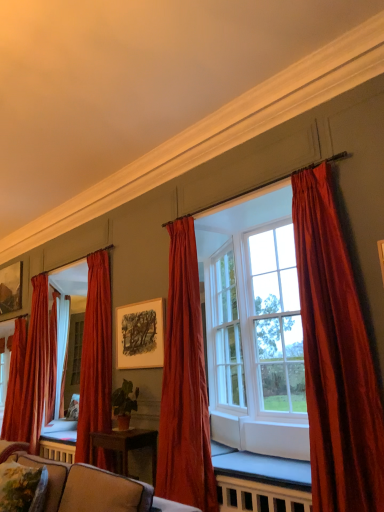
Question: Could you tell me if velvet red curtain at left, which appears as the 5th curtain when viewed from the right, is turned towards velvet curtains at center?

Choices:
 (A) no
 (B) yes

Answer: (A)

Question: Considering the relative sizes of velvet red curtain at left, positioned as the fifth curtain in front-to-back order, and velvet curtains at center in the image provided, is velvet red curtain at left, positioned as the fifth curtain in front-to-back order, wider than velvet curtains at center?

Choices:
 (A) yes
 (B) no

Answer: (B)

Question: Does velvet red curtain at left, positioned as the fifth curtain in front-to-back order, have a larger size compared to velvet curtains at center?

Choices:
 (A) no
 (B) yes

Answer: (A)

Question: Considering the relative sizes of velvet red curtain at left, positioned as the 1th curtain in back-to-front order, and velvet curtains at center in the image provided, is velvet red curtain at left, positioned as the 1th curtain in back-to-front order, smaller than velvet curtains at center?

Choices:
 (A) yes
 (B) no

Answer: (A)

Question: From a real-world perspective, is velvet red curtain at left, positioned as the fifth curtain in front-to-back order, physically below velvet curtains at center?

Choices:
 (A) no
 (B) yes

Answer: (B)

Question: Is velvet curtains at center located within velvet red curtain at left, which appears as the 1th curtain when viewed from the left?

Choices:
 (A) yes
 (B) no

Answer: (B)

Question: From a real-world perspective, is velvet floral pillow at lower left physically above matte white picture frame at center, which is the first picture frame in front-to-back order?

Choices:
 (A) no
 (B) yes

Answer: (A)

Question: Considering the relative sizes of velvet floral pillow at lower left and matte white picture frame at center, placed as the first picture frame when sorted from right to left, in the image provided, is velvet floral pillow at lower left taller than matte white picture frame at center, placed as the first picture frame when sorted from right to left,?

Choices:
 (A) yes
 (B) no

Answer: (B)

Question: Is velvet floral pillow at lower left at the right side of matte white picture frame at center, marked as the second picture frame in a back-to-front arrangement?

Choices:
 (A) no
 (B) yes

Answer: (A)

Question: Is velvet floral pillow at lower left wider than matte white picture frame at center, which is the first picture frame in front-to-back order?

Choices:
 (A) yes
 (B) no

Answer: (A)

Question: Could you tell me if velvet floral pillow at lower left is facing matte white picture frame at center, which is the first picture frame in front-to-back order?

Choices:
 (A) yes
 (B) no

Answer: (B)

Question: From the image's perspective, does velvet floral pillow at lower left appear lower than matte white picture frame at center, placed as the first picture frame when sorted from right to left?

Choices:
 (A) no
 (B) yes

Answer: (B)

Question: Can you confirm if velvet red curtain at left, which appears as the 5th curtain when viewed from the right, is smaller than velvet red curtain at right, which is counted as the fifth curtain, starting from the back?

Choices:
 (A) no
 (B) yes

Answer: (B)